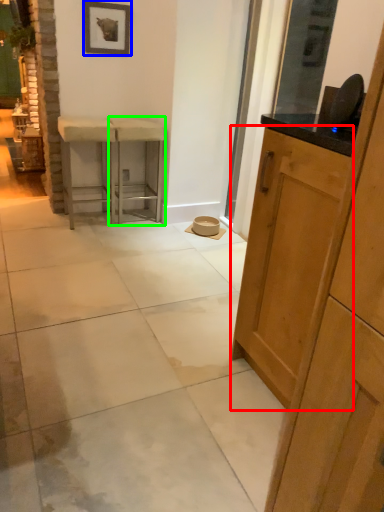
Question: Estimate the real-world distances between objects in this image. Which object is farther from cabinetry (highlighted by a red box), picture frame (highlighted by a blue box) or stool (highlighted by a green box)?

Choices:
 (A) picture frame
 (B) stool

Answer: (A)